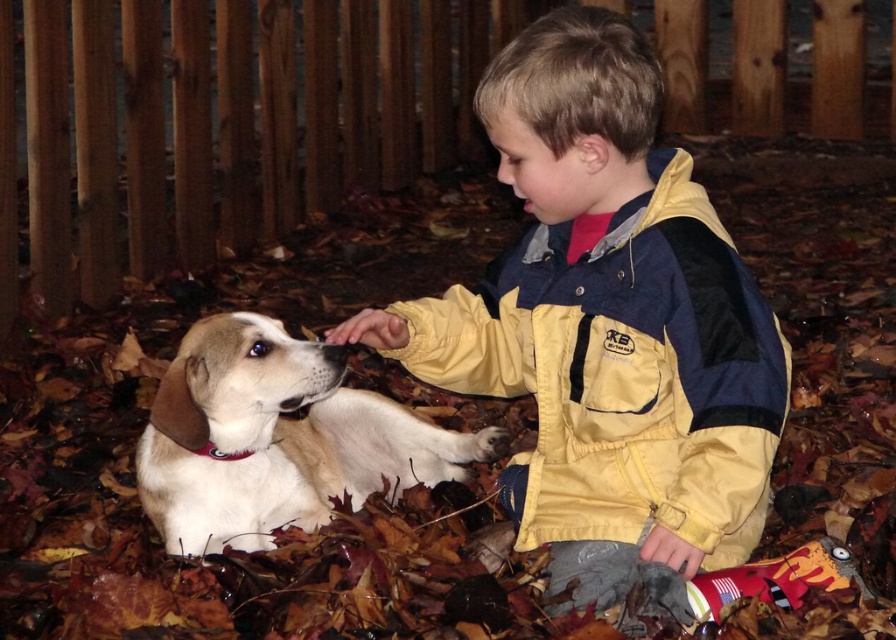
Question: Among these points, which one is nearest to the camera?

Choices:
 (A) (188, 454)
 (B) (630, 472)

Answer: (B)

Question: Can you confirm if yellow nylon jacket at center is thinner than white fur dog at center?

Choices:
 (A) no
 (B) yes

Answer: (A)

Question: Which object is closer to the camera taking this photo?

Choices:
 (A) yellow nylon jacket at center
 (B) white fur dog at center

Answer: (A)

Question: Does yellow nylon jacket at center appear on the right side of white fur dog at center?

Choices:
 (A) yes
 (B) no

Answer: (A)

Question: Is yellow nylon jacket at center behind white fur dog at center?

Choices:
 (A) yes
 (B) no

Answer: (B)